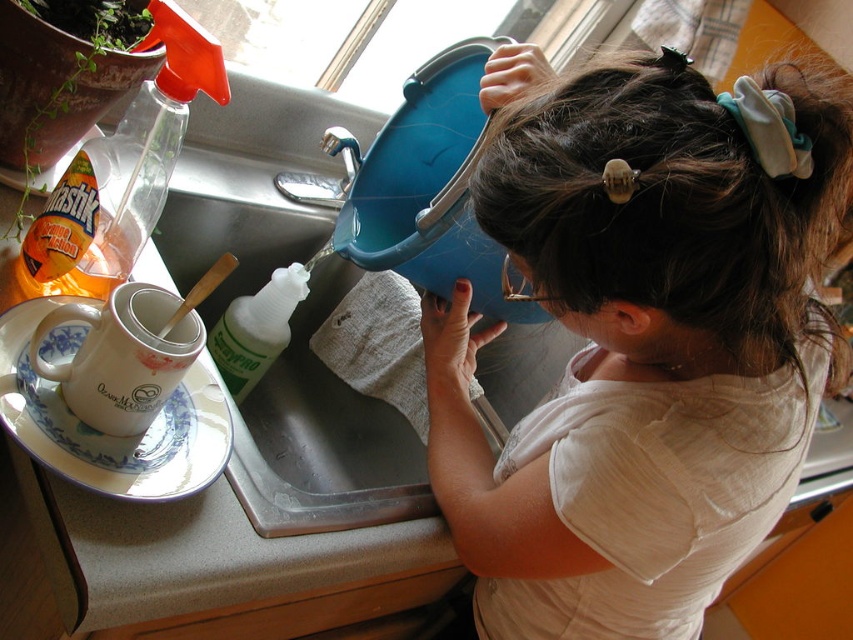
Is point (637, 296) positioned behind point (125, 490)?

No, it is not.

Is light brown hair at upper right behind white ceramic plate at upper left?

No, it is in front of white ceramic plate at upper left.

What do you see at coordinates (641, 348) in the screenshot? I see `light brown hair at upper right` at bounding box center [641, 348].

You are a GUI agent. You are given a task and a screenshot of the screen. Output one action in this format:
    pyautogui.click(x=<x>, y=<y>)
    Task: Click on the light brown hair at upper right
    The height and width of the screenshot is (640, 853).
    Given the screenshot: What is the action you would take?
    pyautogui.click(x=641, y=348)